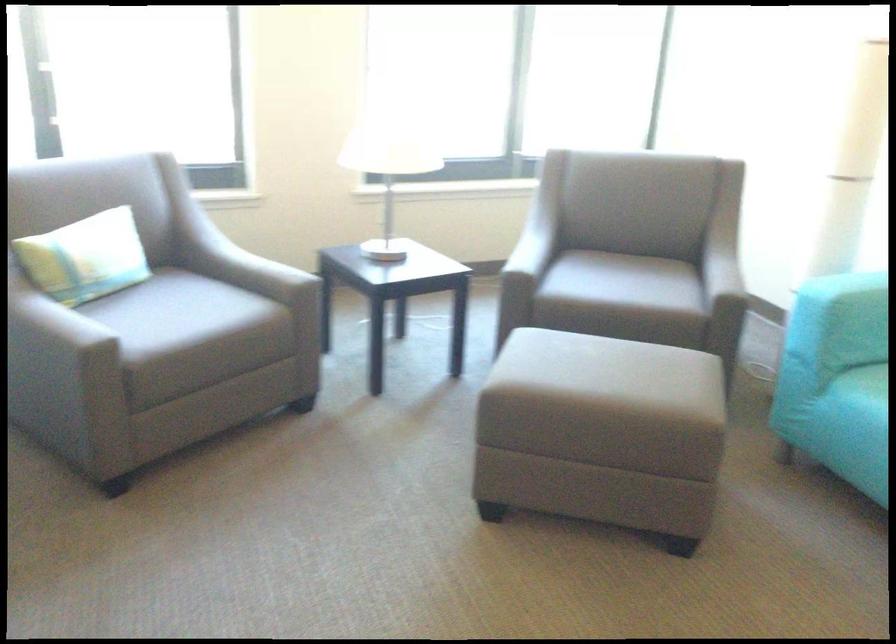
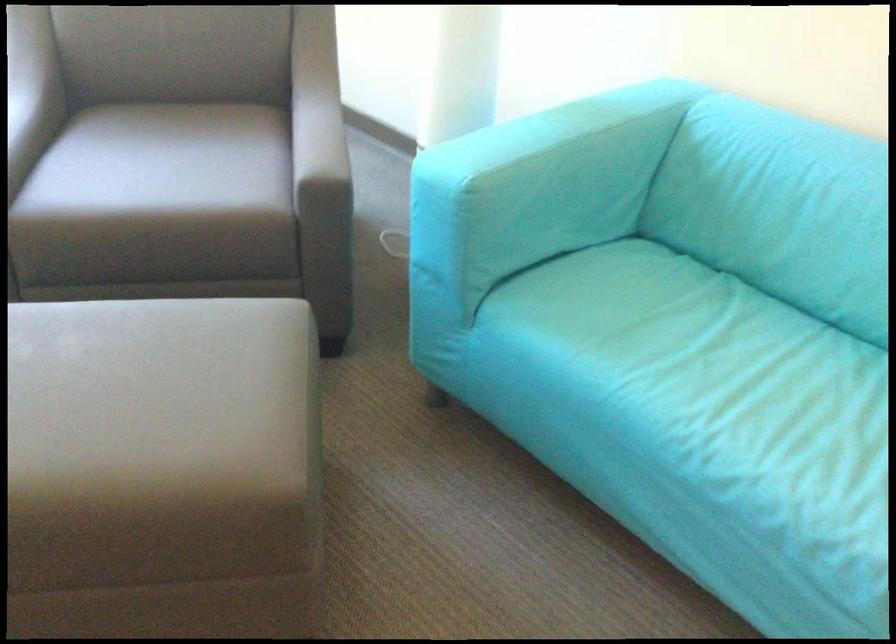
Where in the second image is the point corresponding to point 633,399 from the first image?

(162, 469)